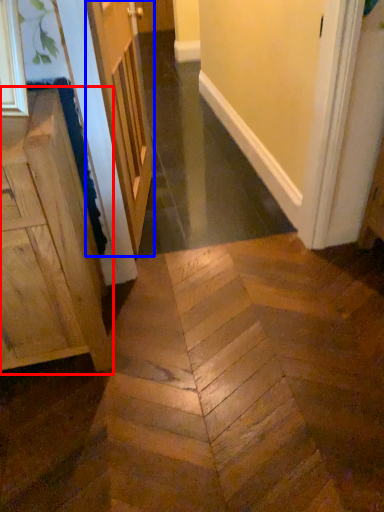
Question: Which of the following is the farthest to the observer, cabinetry (highlighted by a red box) or door (highlighted by a blue box)?

Choices:
 (A) cabinetry
 (B) door

Answer: (B)